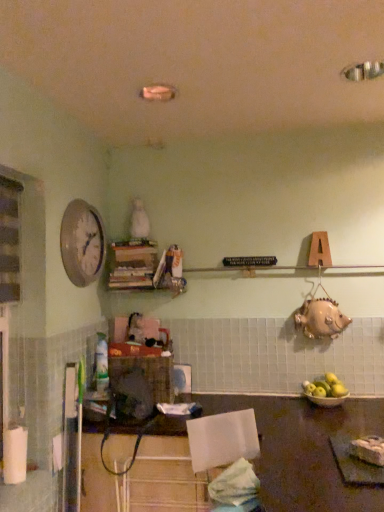
Question: Should I look upward or downward to see white glossy clock at upper left?

Choices:
 (A) down
 (B) up

Answer: (B)

Question: Does yellow matte apple at lower right have a lesser width compared to wooden table at lower center?

Choices:
 (A) yes
 (B) no

Answer: (A)

Question: Could wooden table at lower center be considered to be inside yellow matte apple at lower right?

Choices:
 (A) no
 (B) yes

Answer: (A)

Question: Considering the relative positions of yellow matte apple at lower right and wooden table at lower center in the image provided, is yellow matte apple at lower right to the right of wooden table at lower center from the viewer's perspective?

Choices:
 (A) yes
 (B) no

Answer: (A)

Question: From the image's perspective, is yellow matte apple at lower right above wooden table at lower center?

Choices:
 (A) no
 (B) yes

Answer: (B)

Question: Is yellow matte apple at lower right beside wooden table at lower center?

Choices:
 (A) yes
 (B) no

Answer: (B)

Question: Is yellow matte apple at lower right smaller than wooden table at lower center?

Choices:
 (A) no
 (B) yes

Answer: (B)

Question: Is white matte paper towel at lower left closer to the viewer compared to white glossy clock at upper left?

Choices:
 (A) yes
 (B) no

Answer: (A)

Question: Is white matte paper towel at lower left bigger than white glossy clock at upper left?

Choices:
 (A) no
 (B) yes

Answer: (A)

Question: Can you confirm if white matte paper towel at lower left is shorter than white glossy clock at upper left?

Choices:
 (A) no
 (B) yes

Answer: (B)

Question: From the image's perspective, is white matte paper towel at lower left above white glossy clock at upper left?

Choices:
 (A) no
 (B) yes

Answer: (A)

Question: Does white matte paper towel at lower left touch white glossy clock at upper left?

Choices:
 (A) no
 (B) yes

Answer: (A)

Question: Is white matte paper towel at lower left taller than white glossy clock at upper left?

Choices:
 (A) yes
 (B) no

Answer: (B)

Question: Does white glossy clock at upper left appear on the right side of white matte paper towel at lower left?

Choices:
 (A) no
 (B) yes

Answer: (B)